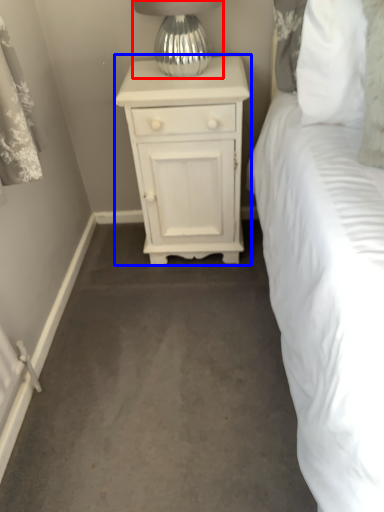
Question: Among these objects, which one is nearest to the camera, table lamp (highlighted by a red box) or nightstand (highlighted by a blue box)?

Choices:
 (A) table lamp
 (B) nightstand

Answer: (A)